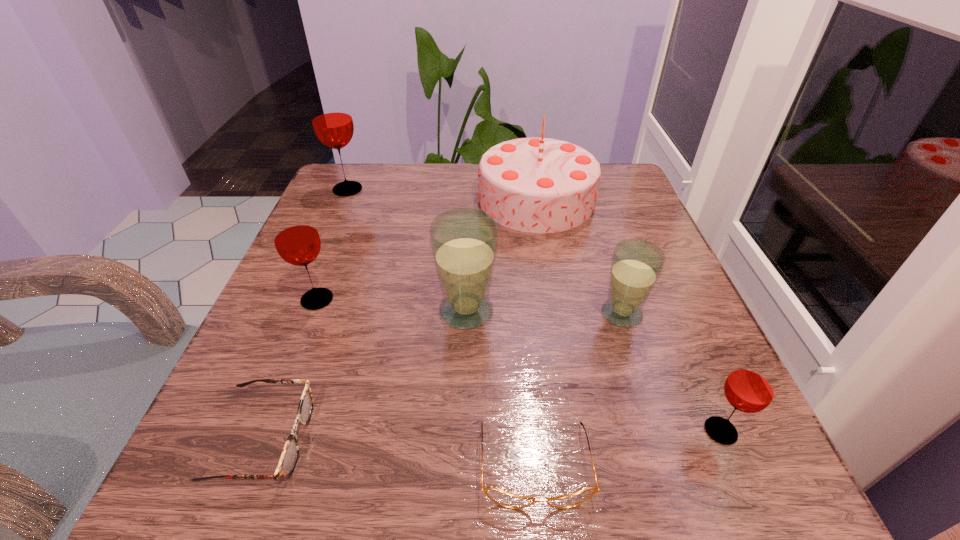
I want to click on vacant space at the left edge, so click(x=326, y=279).

In order to click on vacant space at the right edge in this screenshot , I will do `click(661, 411)`.

Where is `vacant space at the far left corner of the desktop`? The image size is (960, 540). vacant space at the far left corner of the desktop is located at coordinates (x=315, y=212).

The image size is (960, 540). I want to click on free space at the far right corner, so click(612, 167).

Where is `free space between the nearest glass and the farthest red glass`? Image resolution: width=960 pixels, height=540 pixels. free space between the nearest glass and the farthest red glass is located at coordinates (534, 310).

You are a GUI agent. You are given a task and a screenshot of the screen. Output one action in this format:
    pyautogui.click(x=<x>, y=<y>)
    Task: Click on the vacant space in between the second biggest red glass and the right spectacles
    This screenshot has width=960, height=540.
    Given the screenshot: What is the action you would take?
    pyautogui.click(x=426, y=382)

You are a GUI agent. You are given a task and a screenshot of the screen. Output one action in this format:
    pyautogui.click(x=<x>, y=<y>)
    Task: Click on the empty space that is in between the birthday cake and the gold spectacles
    
    Given the screenshot: What is the action you would take?
    pyautogui.click(x=536, y=332)

Where is `unoccupied position between the left spectacles and the second farthest red glass`? unoccupied position between the left spectacles and the second farthest red glass is located at coordinates (291, 369).

Image resolution: width=960 pixels, height=540 pixels. Identify the location of vacant space in between the rightmost glass and the biggest red glass. (534, 310).

You are a GUI agent. You are given a task and a screenshot of the screen. Output one action in this format:
    pyautogui.click(x=<x>, y=<y>)
    Task: Click on the vacant space that is in between the left spectacles and the birthday cake
    
    Given the screenshot: What is the action you would take?
    pyautogui.click(x=400, y=320)